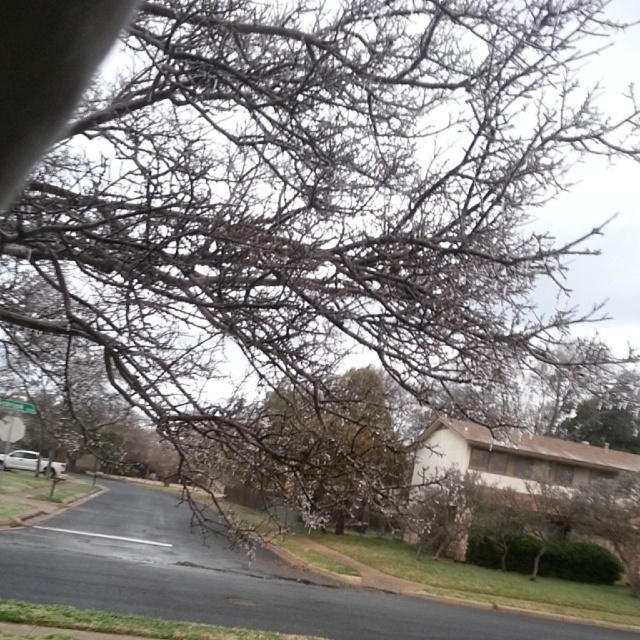
Is silver metallic car at lower left taller than green plastic street sign at lower left?

Indeed, silver metallic car at lower left has a greater height compared to green plastic street sign at lower left.

Between silver metallic car at lower left and green plastic street sign at lower left, which one appears on the left side from the viewer's perspective?

silver metallic car at lower left is more to the left.

Does point (10, 468) come closer to viewer compared to point (26, 403)?

No, it is not.

Identify the location of silver metallic car at lower left. The image size is (640, 640). (29, 461).